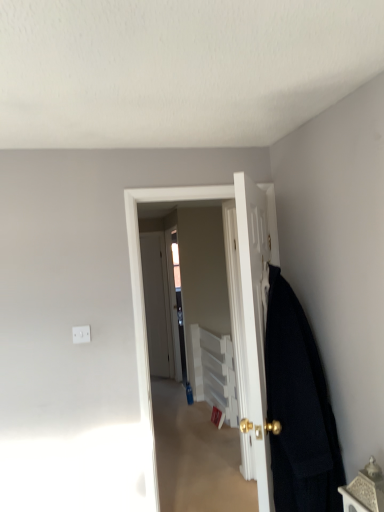
Find the location of `free space to the left of white plastic cabinet at center`. free space to the left of white plastic cabinet at center is located at coordinates (171, 416).